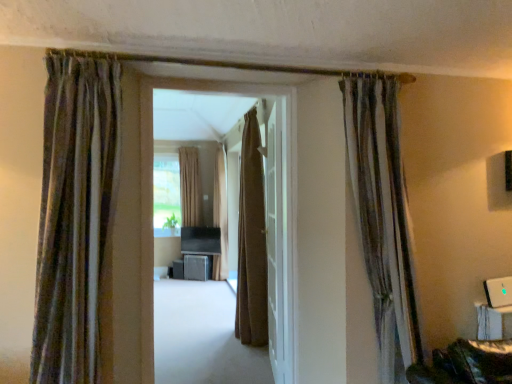
Question: Considering the relative positions of white glossy door at center and matte brown carpet at center in the image provided, is white glossy door at center to the left of matte brown carpet at center from the viewer's perspective?

Choices:
 (A) yes
 (B) no

Answer: (B)

Question: Can you confirm if white glossy door at center is smaller than matte brown carpet at center?

Choices:
 (A) yes
 (B) no

Answer: (A)

Question: From a real-world perspective, does white glossy door at center sit lower than matte brown carpet at center?

Choices:
 (A) yes
 (B) no

Answer: (A)

Question: Are white glossy door at center and matte brown carpet at center located far from each other?

Choices:
 (A) yes
 (B) no

Answer: (B)

Question: From a real-world perspective, does white glossy door at center stand above matte brown carpet at center?

Choices:
 (A) no
 (B) yes

Answer: (A)

Question: Is white glossy door at center positioned behind matte brown carpet at center?

Choices:
 (A) yes
 (B) no

Answer: (A)

Question: Is matte black speaker at center, arranged as the 2th furniture when viewed from the right, touching textured brown curtain at right, positioned as the second curtain in front-to-back order?

Choices:
 (A) yes
 (B) no

Answer: (B)

Question: Is textured brown curtain at right, the fourth curtain in the back-to-front sequence, a part of matte black speaker at center, arranged as the 2th furniture when viewed from the right?

Choices:
 (A) yes
 (B) no

Answer: (B)

Question: From a real-world perspective, does matte black speaker at center, arranged as the 2th furniture when viewed from the right, stand above textured brown curtain at right, the fifth curtain from the left?

Choices:
 (A) no
 (B) yes

Answer: (A)

Question: Considering the relative positions of matte black speaker at center, the first furniture from the left, and textured brown curtain at right, placed as the first curtain when sorted from right to left, in the image provided, is matte black speaker at center, the first furniture from the left, to the right of textured brown curtain at right, placed as the first curtain when sorted from right to left, from the viewer's perspective?

Choices:
 (A) no
 (B) yes

Answer: (A)

Question: Does matte black speaker at center, arranged as the 2th furniture when viewed from the right, lie in front of textured brown curtain at right, positioned as the second curtain in front-to-back order?

Choices:
 (A) no
 (B) yes

Answer: (A)

Question: Are matte black speaker at center, arranged as the 2th furniture when viewed from the right, and textured brown curtain at right, the fourth curtain in the back-to-front sequence, far apart?

Choices:
 (A) no
 (B) yes

Answer: (B)

Question: Is metallic gray cabinet at center, the 1th furniture in the right-to-left sequence, positioned with its back to brown textured curtain at center, positioned as the 4th curtain in front-to-back order?

Choices:
 (A) yes
 (B) no

Answer: (B)